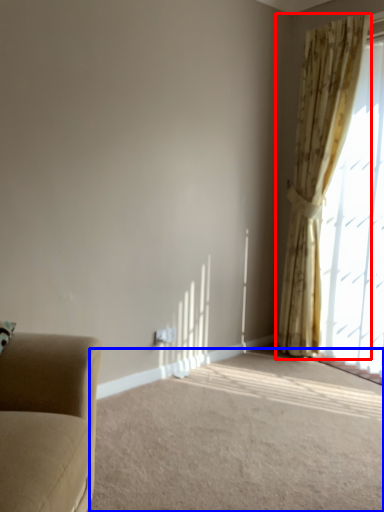
Question: Which of the following is the farthest to the observer, curtain (highlighted by a red box) or plain (highlighted by a blue box)?

Choices:
 (A) curtain
 (B) plain

Answer: (A)